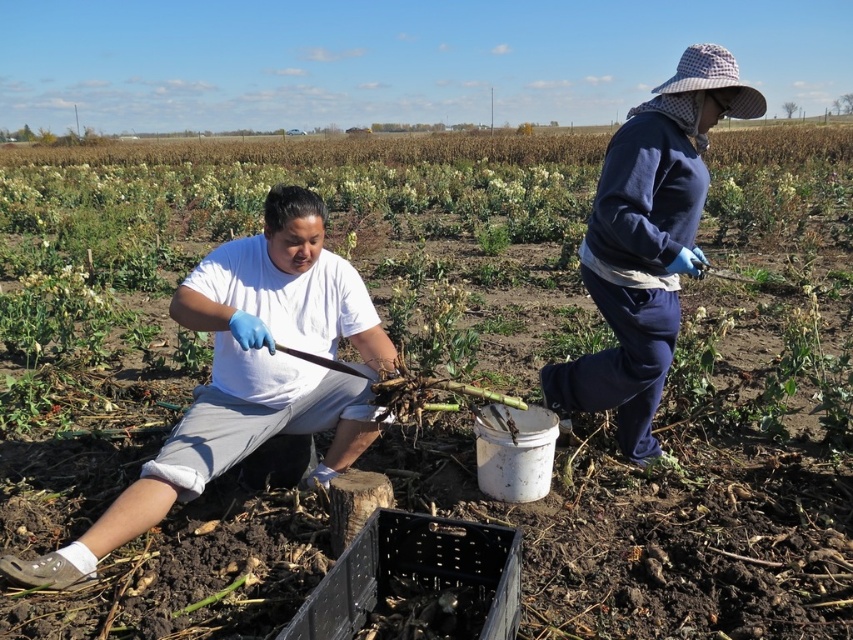
You are standing in the field and want to hand a tool to both the person in the white cotton shirt at center and the person in the navy fleece jacket at upper right. Which person should you approach first to ensure you can reach them without moving too far from your current position?

You should approach the white cotton shirt at center first because it is closer to you than the navy fleece jacket at upper right, so you can reach them without moving as far.

You are a farmer planning to hang both the white cotton shirt at center and the navy fleece jacket at upper right on a clothesline. The clothesline is only 1.2 meters tall. Which item will require a taller clothesline to dry properly?

The navy fleece jacket at upper right requires a taller clothesline because it has a greater height than the white cotton shirt at center, which is shorter. Since the clothesline is only 1.2 meters tall, the jacket may need a higher line to avoid touching the ground.